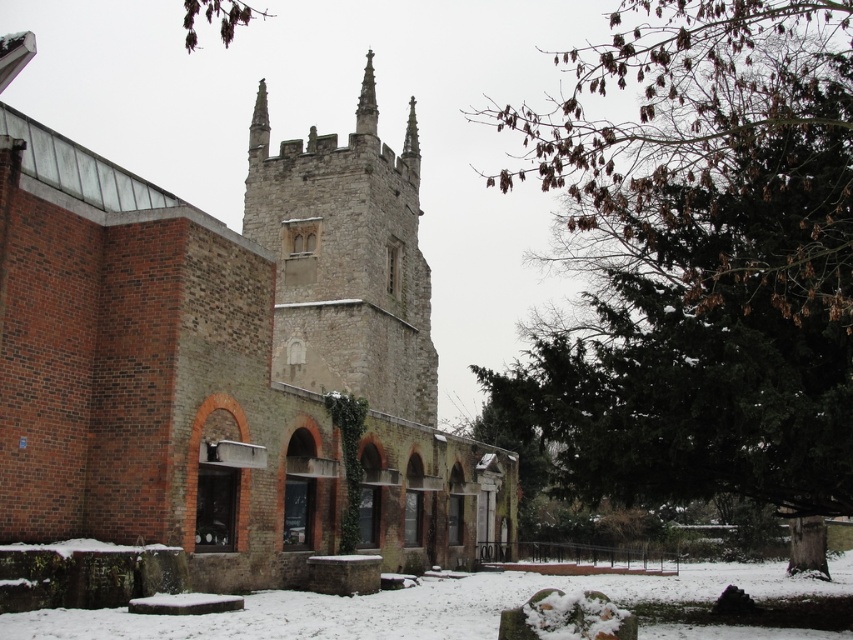
From the picture: You are standing in the winter scene and want to take a photo of the gray stone tower at center and the white powdery snow at lower center. Which object should you focus on first if you want to capture both in a single frame without moving the camera?

The gray stone tower at center is smaller than the white powdery snow at lower center, so you should focus on the gray stone tower at center first as it is closer to the camera and smaller in size, allowing both objects to fit within the frame.

You are an architect analyzing the structure of the gray stone tower at center and the smooth stone spire at center. Which of these two structures is bigger in size?

The gray stone tower at center is larger in size compared to the smooth stone spire at center.